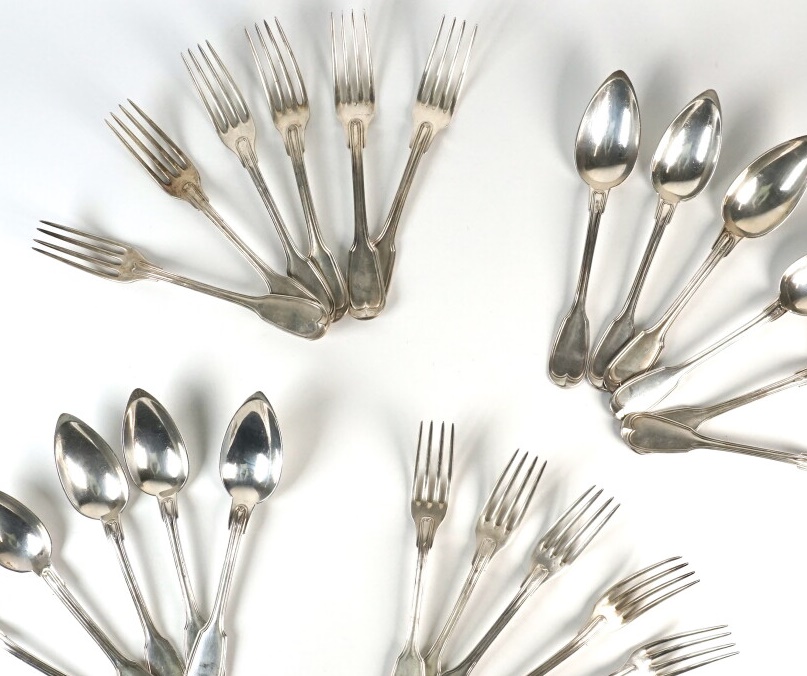
At what (x,y) coordinates should I click in order to perform the action: click on silverware on the lower half of the image. Please return your answer as a coordinate pair (x, y). Looking at the image, I should click on (22, 652), (40, 556), (99, 496), (156, 475), (237, 464), (423, 496), (495, 535), (552, 548), (625, 598), (663, 650).